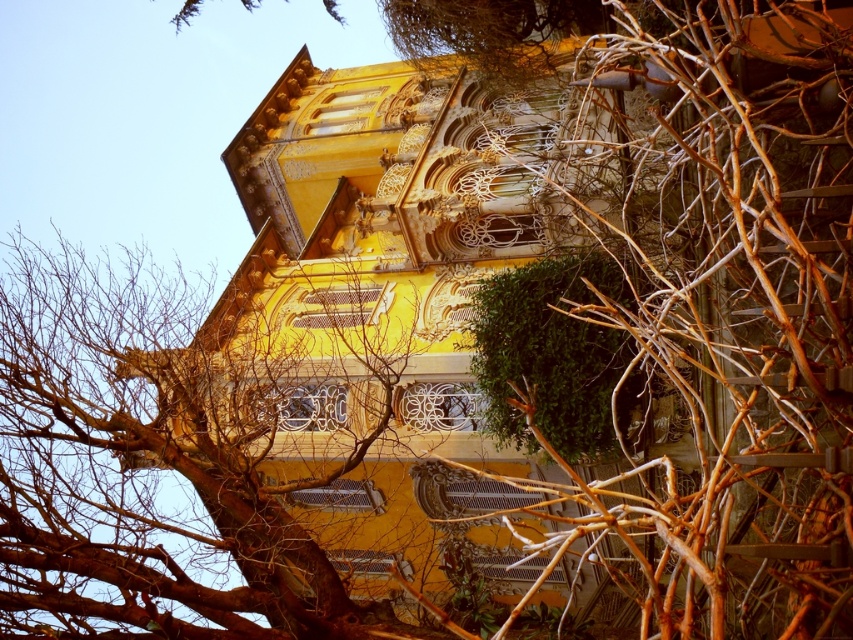
You are standing in front of the yellow building and want to take a photo of the green leafy bush at center without the brown bark tree at upper left blocking the view. Which direction should you move to achieve this?

Move to the right side of the green leafy bush at center so that the brown bark tree at upper left is no longer in front of it. Since the brown bark tree at upper left is to the left of the green leafy bush at center, moving right would position you away from the tree, allowing an unobstructed view of the bush.

You are an architect planning to take a clear photo of the yellow building in the scene. However, the brown woody branches at center and the green leafy bush at center are blocking the view. Which object is closer to the camera, making it the primary obstruction?

The brown woody branches at center is closer to the camera than the green leafy bush at center, as it is only 22.97 feet away from the bush. Therefore, the brown woody branches at center is the primary obstruction blocking the view of the yellow building.

You are an artist trying to paint the scene of the yellow building. You notice brown woody branches at center and green leafy bush at center. Which object is closer to the viewer?

The brown woody branches at center is positioned over the green leafy bush at center, so it is closer to the viewer.